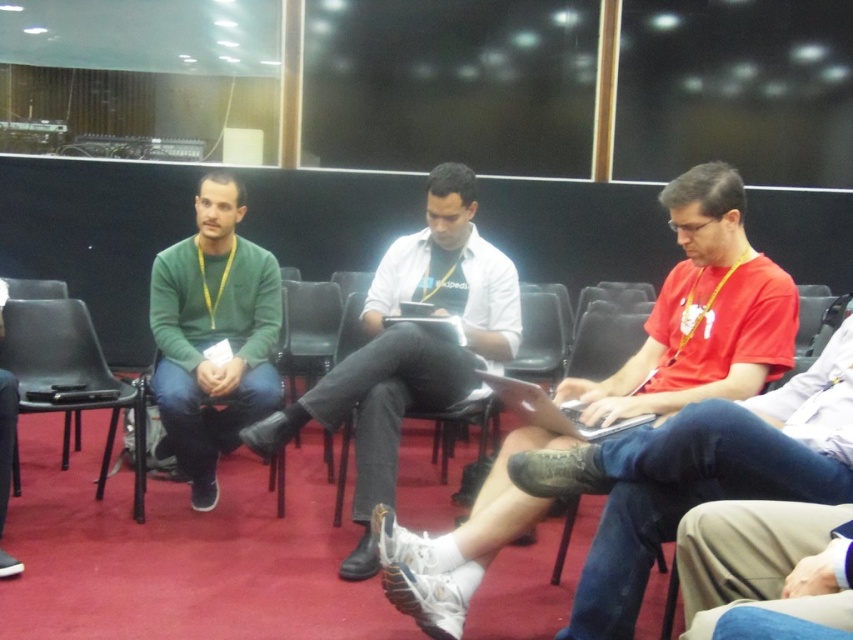
Question: Among these points, which one is nearest to the camera?

Choices:
 (A) (70, 342)
 (B) (387, 474)
 (C) (207, 186)

Answer: (B)

Question: Is the position of matte red shirt at center more distant than that of black leather chair at center?

Choices:
 (A) yes
 (B) no

Answer: (B)

Question: Is black plastic chair at left further to the viewer compared to black leather chair at center?

Choices:
 (A) no
 (B) yes

Answer: (B)

Question: Observing the image, what is the correct spatial positioning of matte white laptop at center in reference to black leather chair at center?

Choices:
 (A) above
 (B) below

Answer: (A)

Question: Which of the following is the farthest from the observer?

Choices:
 (A) black plastic chair at left
 (B) matte white laptop at center
 (C) white matte shirt at center
 (D) green matte sweater at center

Answer: (D)

Question: Which of these objects is positioned closest to the black leather chair at center?

Choices:
 (A) green matte sweater at center
 (B) black plastic chair at left
 (C) white matte shirt at center
 (D) matte red shirt at center

Answer: (C)